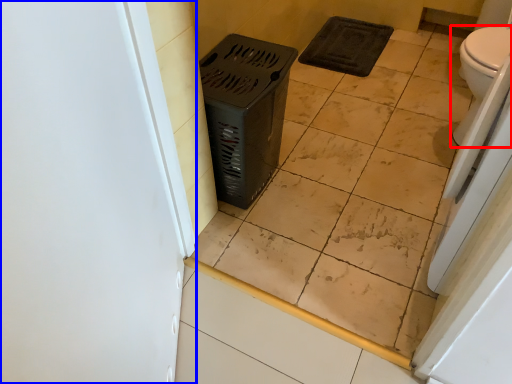
Question: Among these objects, which one is farthest to the camera, toilet (highlighted by a red box) or screen door (highlighted by a blue box)?

Choices:
 (A) toilet
 (B) screen door

Answer: (A)